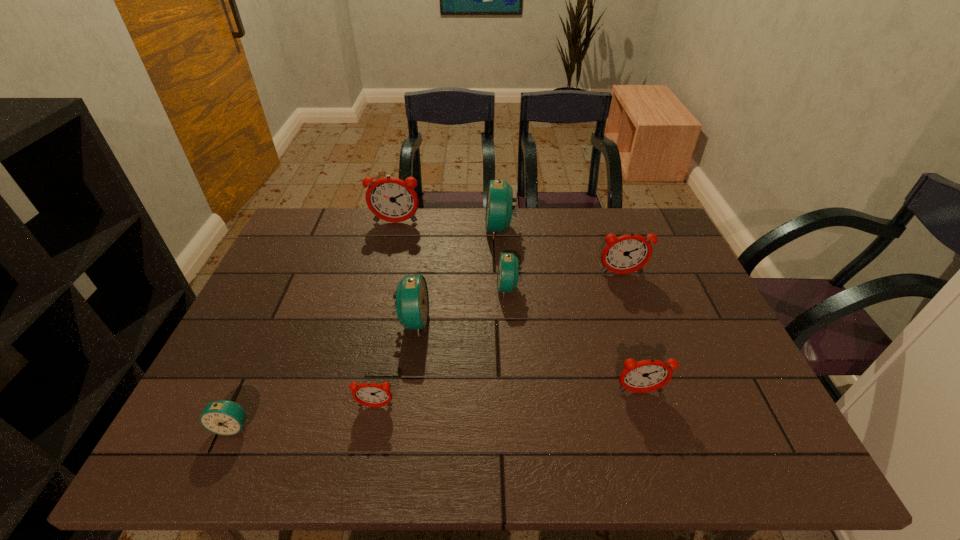
In the image, there is a desktop. At what (x,y) coordinates should I click in order to perform the action: click on vacant region at the right edge. Please return your answer as a coordinate pair (x, y). The height and width of the screenshot is (540, 960). Looking at the image, I should click on (692, 314).

This screenshot has width=960, height=540. Identify the location of free space at the far left corner of the desktop. (300, 231).

Locate an element on the screen. The image size is (960, 540). free point between the second biggest reddish-pink alarm clock and the farthest reddish-pink alarm clock is located at coordinates (509, 248).

This screenshot has width=960, height=540. What are the coordinates of `blank region between the second biggest blue alarm clock and the third smallest reddish-pink alarm clock` in the screenshot? It's located at (517, 298).

You are a GUI agent. You are given a task and a screenshot of the screen. Output one action in this format:
    pyautogui.click(x=<x>, y=<y>)
    Task: Click on the blank region between the farthest reddish-pink alarm clock and the second biggest reddish-pink alarm clock
    This screenshot has height=540, width=960.
    Given the screenshot: What is the action you would take?
    tap(509, 248)

The height and width of the screenshot is (540, 960). I want to click on free spot between the farthest reddish-pink alarm clock and the third smallest blue alarm clock, so click(404, 272).

At what (x,y) coordinates should I click in order to perform the action: click on free space between the smallest blue alarm clock and the third farthest blue alarm clock. Please return your answer as a coordinate pair (x, y). Looking at the image, I should click on (323, 374).

Find the location of `free spot between the second smallest reddish-pink alarm clock and the fifth farthest alarm clock`. free spot between the second smallest reddish-pink alarm clock and the fifth farthest alarm clock is located at coordinates (526, 357).

You are a GUI agent. You are given a task and a screenshot of the screen. Output one action in this format:
    pyautogui.click(x=<x>, y=<y>)
    Task: Click on the vacant region between the third nearest reddish-pink alarm clock and the third nearest object
    This screenshot has height=540, width=960.
    Given the screenshot: What is the action you would take?
    pyautogui.click(x=631, y=333)

Where is `empty space between the nearest blue alarm clock and the second nearest reddish-pink alarm clock`? This screenshot has width=960, height=540. empty space between the nearest blue alarm clock and the second nearest reddish-pink alarm clock is located at coordinates (436, 409).